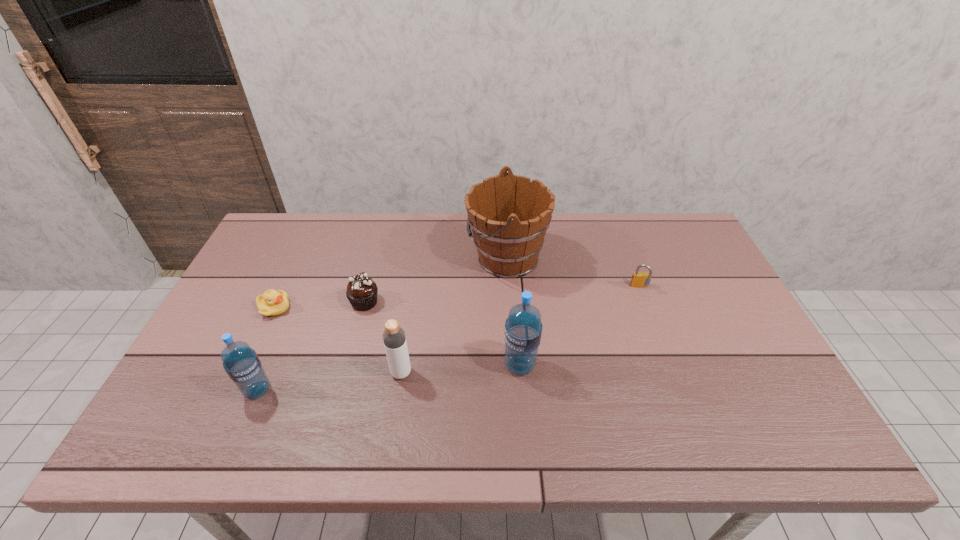
The image size is (960, 540). In order to click on vacant space that satisfies the following two spatial constraints: 1. on the back side of the fourth object from left to right; 2. on the right side of the left water bottle in this screenshot , I will do coord(265,373).

The height and width of the screenshot is (540, 960). Identify the location of free spot that satisfies the following two spatial constraints: 1. at the face of the shortest object; 2. on the right side of the taller water bottle. [248, 365].

The image size is (960, 540). Identify the location of free space that satisfies the following two spatial constraints: 1. at the face of the bottle; 2. on the right side of the duckling. (244, 373).